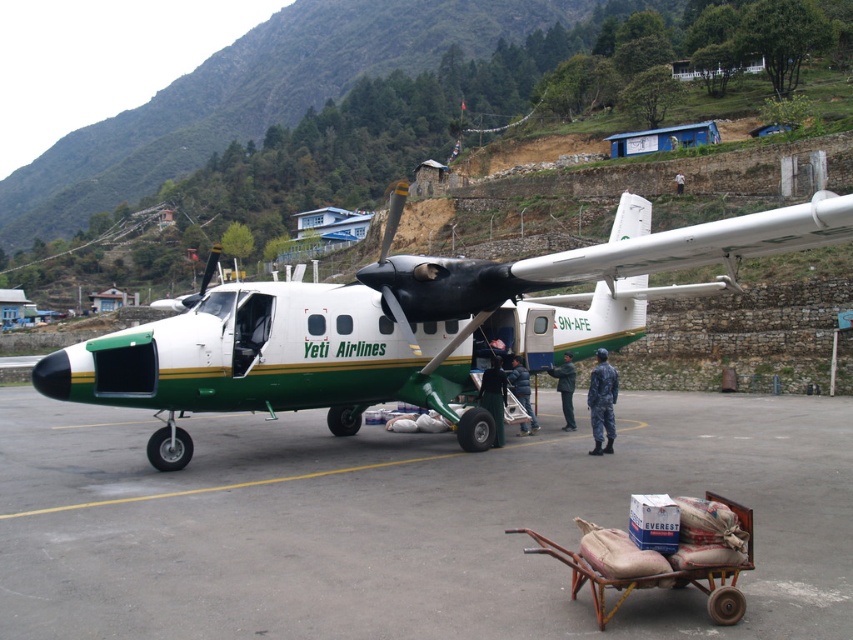
Is dark blue jacket at center bigger than white fabric shirt at center?

No, dark blue jacket at center is not bigger than white fabric shirt at center.

Does dark blue jacket at center have a greater width compared to white fabric shirt at center?

No.

Is point (515, 364) positioned behind point (682, 176)?

No, it is in front of (682, 176).

This screenshot has height=640, width=853. What are the coordinates of `dark blue jacket at center` in the screenshot? It's located at (521, 394).

Image resolution: width=853 pixels, height=640 pixels. Find the location of `dark blue uniform at center`. dark blue uniform at center is located at coordinates (602, 403).

Is point (599, 380) positioned after point (677, 176)?

No.

Locate an element on the screen. dark blue uniform at center is located at coordinates (602, 403).

Is white matte airplane at center wider than dark blue uniform at center?

Yes.

Does white matte airplane at center have a smaller size compared to dark blue uniform at center?

No, white matte airplane at center is not smaller than dark blue uniform at center.

Describe the element at coordinates (396, 324) in the screenshot. I see `white matte airplane at center` at that location.

You are a GUI agent. You are given a task and a screenshot of the screen. Output one action in this format:
    pyautogui.click(x=<x>, y=<y>)
    Task: Click on the white matte airplane at center
    
    Given the screenshot: What is the action you would take?
    (x=396, y=324)